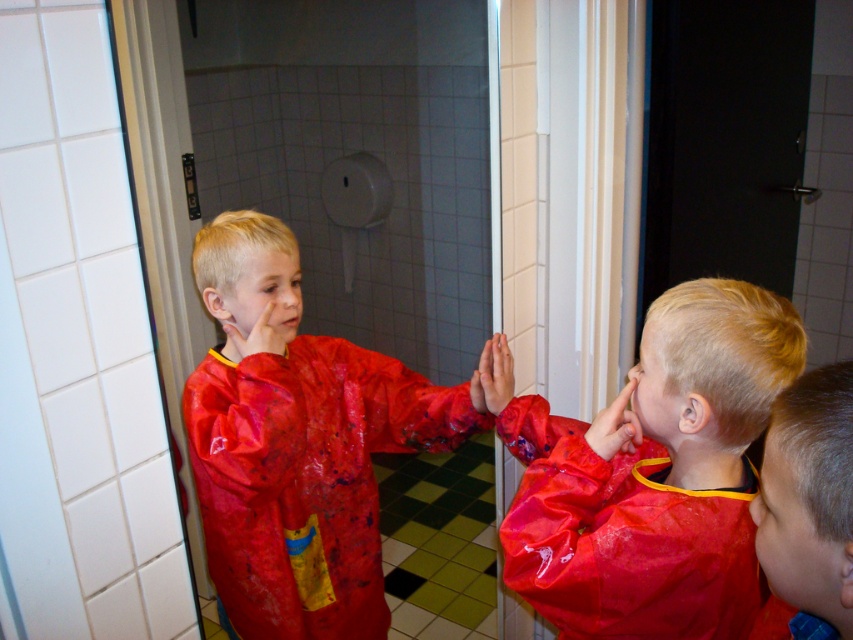
You are a photographer adjusting your camera to focus on two points in the scene. The first point is point (x=578, y=508) and the second is point (x=849, y=518). Which point should you focus on first if you want to capture the closest object to the camera?

You should focus on point (x=578, y=508) first because it is closer to the camera than point (x=849, y=518).

You are a parent trying to clean your child who is wearing a shiny red raincoat at center and a shiny red raincoat at lower right. Which raincoat is taller?

The shiny red raincoat at center is much taller than the shiny red raincoat at lower right.